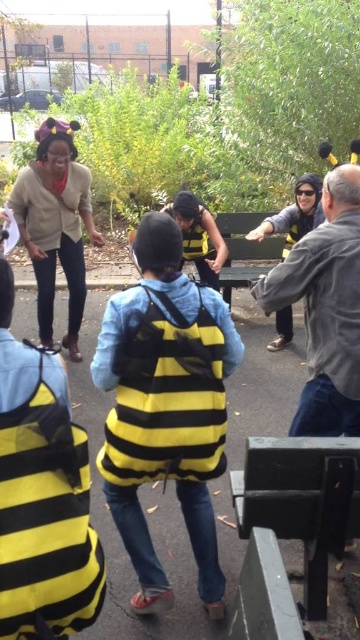
Question: In this image, where is gray woolen jacket at upper right located relative to matte beige cardigan at upper left?

Choices:
 (A) above
 (B) below

Answer: (B)

Question: Among these objects, which one is nearest to the camera?

Choices:
 (A) yellow matte bee costume at center
 (B) gray woolen jacket at upper right
 (C) wooden park bench at center
 (D) matte beige cardigan at upper left

Answer: (B)

Question: Among these objects, which one is farthest from the camera?

Choices:
 (A) yellow and black costume at center
 (B) soft plush bee costume at center

Answer: (A)

Question: Which object is closer to the camera taking this photo?

Choices:
 (A) metallic silver picnic table at lower center
 (B) wooden park bench at center

Answer: (A)

Question: Does soft plush bee costume at center come behind metallic silver picnic table at lower center?

Choices:
 (A) no
 (B) yes

Answer: (B)

Question: Is soft plush bee costume at center below yellow matte bee costume at center?

Choices:
 (A) no
 (B) yes

Answer: (B)